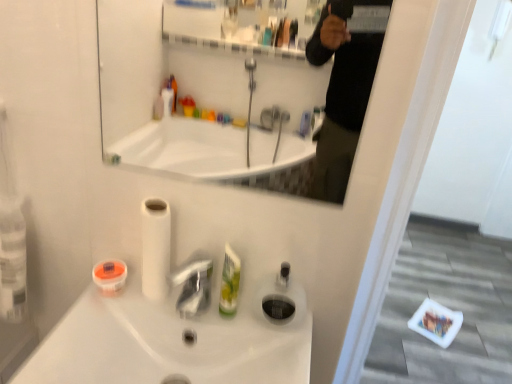
Question: Does white glossy sink at center have a smaller size compared to white glossy mirror at upper center?

Choices:
 (A) yes
 (B) no

Answer: (B)

Question: Can you confirm if white glossy sink at center is wider than white glossy mirror at upper center?

Choices:
 (A) no
 (B) yes

Answer: (B)

Question: Is white glossy sink at center next to white glossy mirror at upper center and touching it?

Choices:
 (A) no
 (B) yes

Answer: (A)

Question: From the image's perspective, is white glossy sink at center above white glossy mirror at upper center?

Choices:
 (A) no
 (B) yes

Answer: (A)

Question: Is white glossy mirror at upper center completely or partially inside white glossy sink at center?

Choices:
 (A) no
 (B) yes

Answer: (A)

Question: Looking at the image, does white matte toilet paper at center seem bigger or smaller compared to white glossy sink at center?

Choices:
 (A) big
 (B) small

Answer: (B)

Question: Considering their positions, is white matte toilet paper at center located in front of or behind white glossy sink at center?

Choices:
 (A) behind
 (B) front

Answer: (A)

Question: From a real-world perspective, is white matte toilet paper at center positioned above or below white glossy sink at center?

Choices:
 (A) below
 (B) above

Answer: (B)

Question: In terms of height, does white matte toilet paper at center look taller or shorter compared to white glossy sink at center?

Choices:
 (A) short
 (B) tall

Answer: (B)

Question: From the image's perspective, is white glossy mirror at upper center located above or below green plastic mouthwash at center, which is counted as the second mouthwash, starting from the left?

Choices:
 (A) below
 (B) above

Answer: (B)

Question: In the image, is white glossy mirror at upper center positioned in front of or behind green plastic mouthwash at center, the 1th mouthwash in the right-to-left sequence?

Choices:
 (A) front
 (B) behind

Answer: (A)

Question: Visually, is white glossy mirror at upper center positioned to the left or to the right of green plastic mouthwash at center, the 1th mouthwash in the right-to-left sequence?

Choices:
 (A) right
 (B) left

Answer: (A)

Question: Considering the positions of white glossy mirror at upper center and green plastic mouthwash at center, which is counted as the second mouthwash, starting from the left, in the image, is white glossy mirror at upper center wider or thinner than green plastic mouthwash at center, which is counted as the second mouthwash, starting from the left,?

Choices:
 (A) wide
 (B) thin

Answer: (B)

Question: Is point (152, 130) positioned closer to the camera than point (287, 264)?

Choices:
 (A) closer
 (B) farther

Answer: (B)

Question: In terms of height, does white glossy mirror at upper center look taller or shorter compared to transparent plastic soap dispenser at center?

Choices:
 (A) tall
 (B) short

Answer: (A)